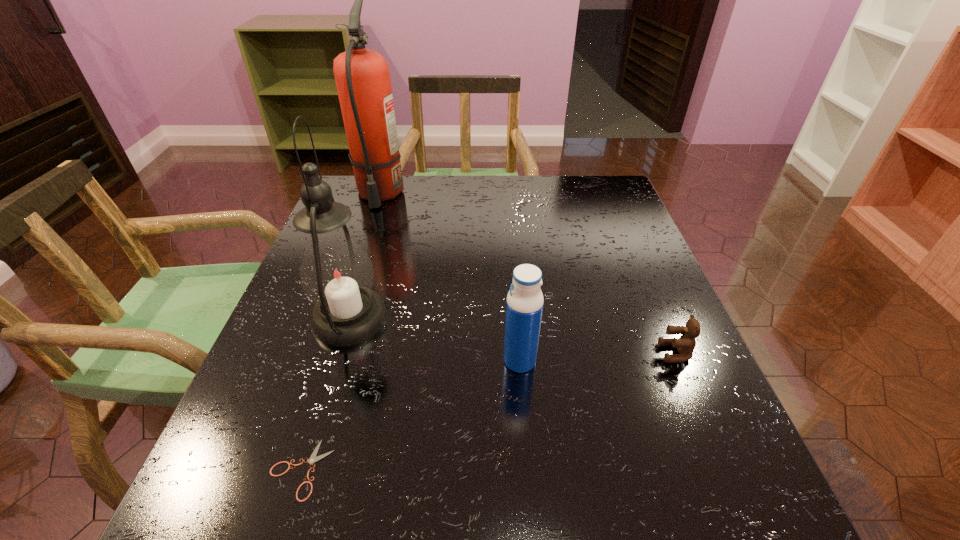
The width and height of the screenshot is (960, 540). Identify the location of free area in between the fourth tallest object and the third tallest object. click(597, 357).

You are a GUI agent. You are given a task and a screenshot of the screen. Output one action in this format:
    pyautogui.click(x=<x>, y=<y>)
    Task: Click on the blank region between the shears and the oil lamp
    
    Given the screenshot: What is the action you would take?
    pyautogui.click(x=325, y=394)

The image size is (960, 540). Identify the location of empty space that is in between the teddy bear and the second object from right to left. (597, 357).

Locate which object is the fourth closest to the third tallest object. Please provide its 2D coordinates. Your answer should be formatted as a tuple, i.e. [(x, y)], where the tuple contains the x and y coordinates of a point satisfying the conditions above.

[(362, 76)]

Identify the location of object identified as the closest to the water bottle. (336, 273).

This screenshot has height=540, width=960. I want to click on free space that satisfies the following two spatial constraints: 1. on the nozzle of the oil lamp; 2. on the left side of the farthest object, so click(338, 319).

The image size is (960, 540). I want to click on free space that satisfies the following two spatial constraints: 1. on the nozzle of the shortest object; 2. on the left side of the farthest object, so click(x=288, y=469).

Identify the location of free space that satisfies the following two spatial constraints: 1. on the nozzle of the fourth object from left to right; 2. on the right side of the fire extinguisher. This screenshot has height=540, width=960. (324, 361).